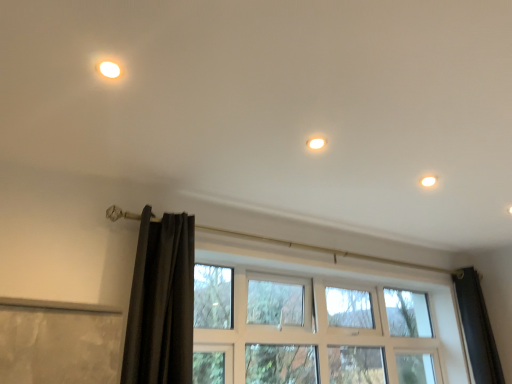
Question: Is black velvet curtain at left further to camera compared to matte white light at upper left?

Choices:
 (A) yes
 (B) no

Answer: (A)

Question: From the image's perspective, is black velvet curtain at left below matte white light at upper left?

Choices:
 (A) yes
 (B) no

Answer: (A)

Question: Considering the relative sizes of black velvet curtain at left and matte white light at upper left in the image provided, is black velvet curtain at left wider than matte white light at upper left?

Choices:
 (A) yes
 (B) no

Answer: (A)

Question: Does black velvet curtain at left have a smaller size compared to matte white light at upper left?

Choices:
 (A) yes
 (B) no

Answer: (B)

Question: Is black velvet curtain at left taller than matte white light at upper left?

Choices:
 (A) yes
 (B) no

Answer: (A)

Question: Considering the positions of clear glass window at center and black velvet curtain at left in the image, is clear glass window at center wider or thinner than black velvet curtain at left?

Choices:
 (A) wide
 (B) thin

Answer: (A)

Question: Is point (379, 377) closer or farther from the camera than point (165, 273)?

Choices:
 (A) farther
 (B) closer

Answer: (A)

Question: Is clear glass window at center bigger or smaller than black velvet curtain at left?

Choices:
 (A) big
 (B) small

Answer: (A)

Question: From a real-world perspective, is clear glass window at center above or below black velvet curtain at left?

Choices:
 (A) below
 (B) above

Answer: (A)

Question: From the image's perspective, is white glossy light fixture at upper right located above or below black velvet curtain at left?

Choices:
 (A) above
 (B) below

Answer: (A)

Question: In terms of width, does white glossy light fixture at upper right look wider or thinner when compared to black velvet curtain at left?

Choices:
 (A) wide
 (B) thin

Answer: (B)

Question: In the image, is white glossy light fixture at upper right positioned in front of or behind black velvet curtain at left?

Choices:
 (A) behind
 (B) front

Answer: (A)

Question: Is point (425, 175) positioned closer to the camera than point (181, 370)?

Choices:
 (A) closer
 (B) farther

Answer: (B)

Question: Looking at their shapes, would you say black velvet curtain at left is wider or thinner than matte white light at upper left?

Choices:
 (A) thin
 (B) wide

Answer: (B)

Question: Visually, is black velvet curtain at left positioned to the left or to the right of matte white light at upper left?

Choices:
 (A) right
 (B) left

Answer: (A)